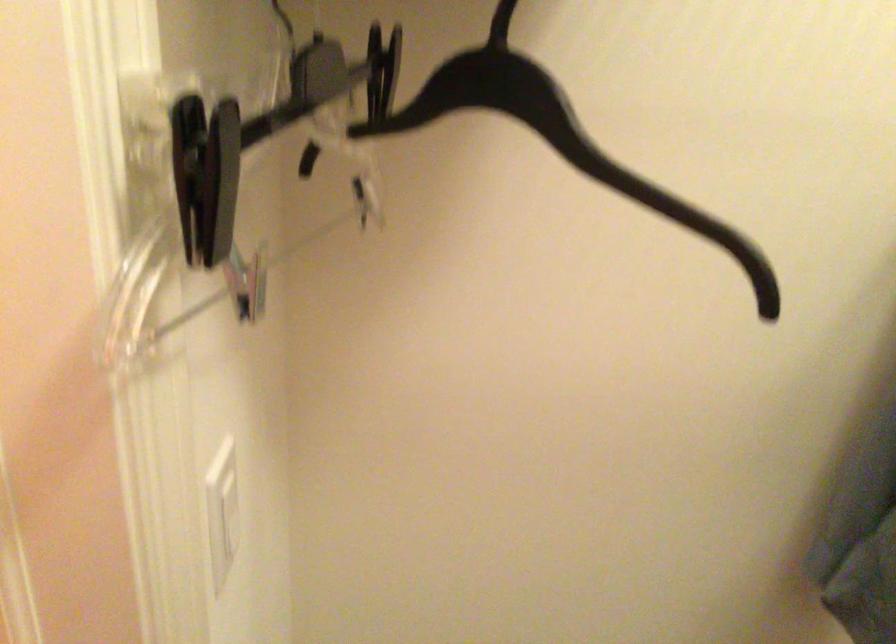
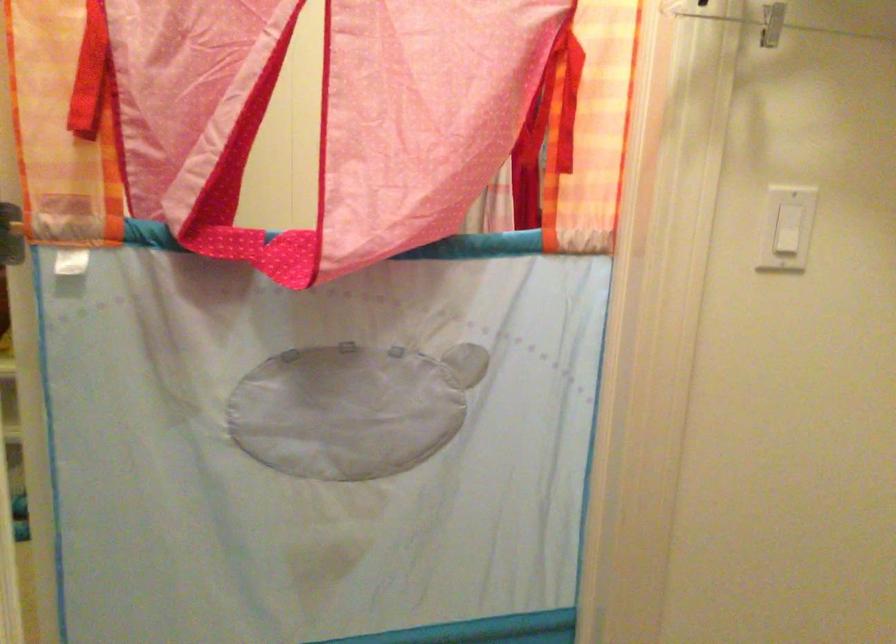
In the second image, find the point that corresponds to point 235,502 in the first image.

(786, 228)